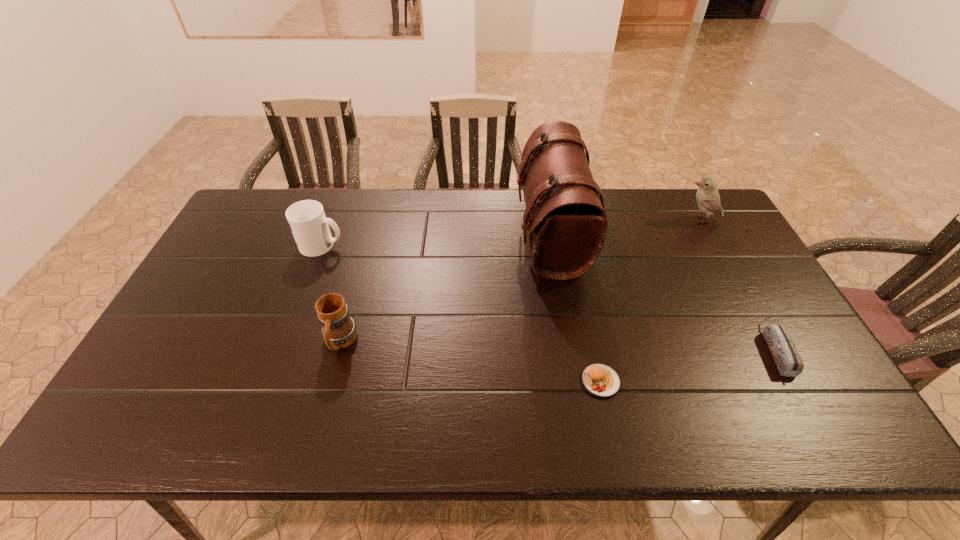
Locate an element on the screen. The height and width of the screenshot is (540, 960). the tallest object is located at coordinates (565, 217).

Find the location of a particular element. Image resolution: width=960 pixels, height=540 pixels. the fifth shortest object is located at coordinates pyautogui.click(x=708, y=199).

The width and height of the screenshot is (960, 540). Find the location of `the leftmost object`. the leftmost object is located at coordinates (309, 225).

What are the coordinates of `the farther mug` in the screenshot? It's located at (309, 225).

The width and height of the screenshot is (960, 540). I want to click on the nearer mug, so click(339, 331).

You are a GUI agent. You are given a task and a screenshot of the screen. Output one action in this format:
    pyautogui.click(x=<x>, y=<y>)
    Task: Click on the second object from left to right
    The height and width of the screenshot is (540, 960).
    Given the screenshot: What is the action you would take?
    pyautogui.click(x=339, y=331)

This screenshot has width=960, height=540. In order to click on pencil box in this screenshot , I will do `click(786, 356)`.

This screenshot has width=960, height=540. What are the coordinates of `patty` in the screenshot? It's located at (600, 380).

Find the location of a particular element. The image size is (960, 540). vacant area situated on the front-facing side of the satchel is located at coordinates (409, 234).

This screenshot has width=960, height=540. I want to click on vacant space located on the front-facing side of the satchel, so click(x=433, y=234).